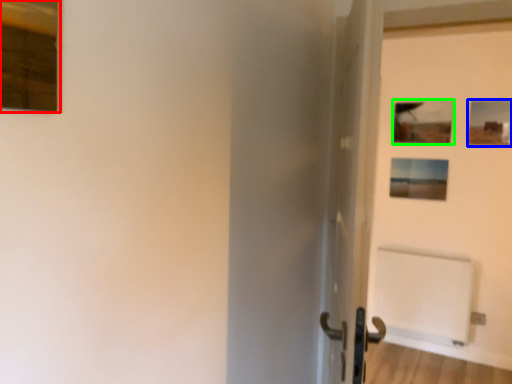
Question: Which object is the closest to the picture frame (highlighted by a red box)? Choose among these: picture frame (highlighted by a blue box) or picture frame (highlighted by a green box).

Choices:
 (A) picture frame
 (B) picture frame

Answer: (B)